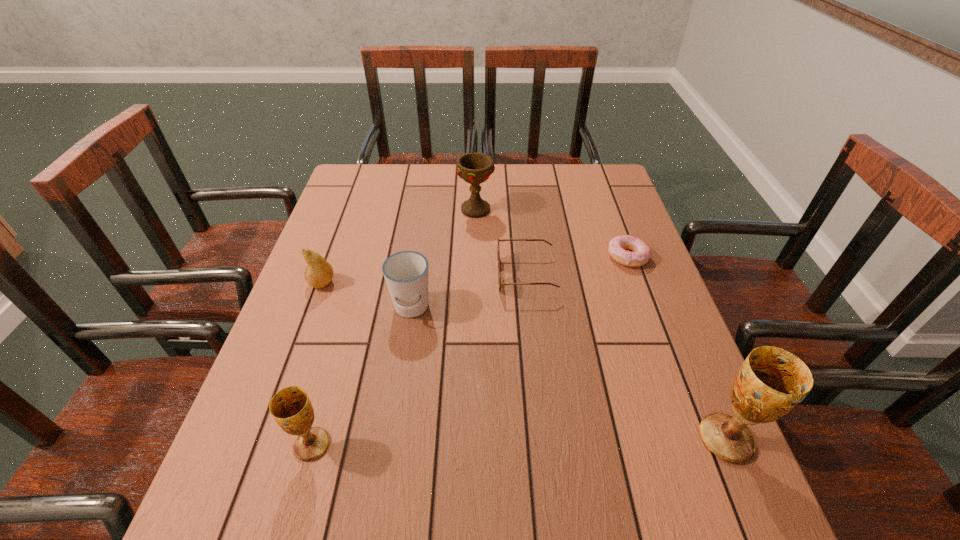
The image size is (960, 540). In order to click on object that stands as the third closest to the cup in this screenshot , I will do `click(291, 408)`.

Image resolution: width=960 pixels, height=540 pixels. What are the coordinates of `the fourth closest object to the rightmost chalice` in the screenshot? It's located at point(291,408).

Identify the location of chalice that stands as the second closest to the pear. (475, 168).

Select which chalice is the second closest to the fourth object from left to right. Please provide its 2D coordinates. Your answer should be formatted as a tuple, i.e. [(x, y)], where the tuple contains the x and y coordinates of a point satisfying the conditions above.

[(772, 381)]

I want to click on free location that satisfies the following two spatial constraints: 1. at the front view of the spectacles; 2. on the back side of the rightmost chalice, so click(544, 438).

Find the location of a particular element. vacant space that satisfies the following two spatial constraints: 1. on the front side of the tallest chalice; 2. on the left side of the doughnut is located at coordinates (694, 438).